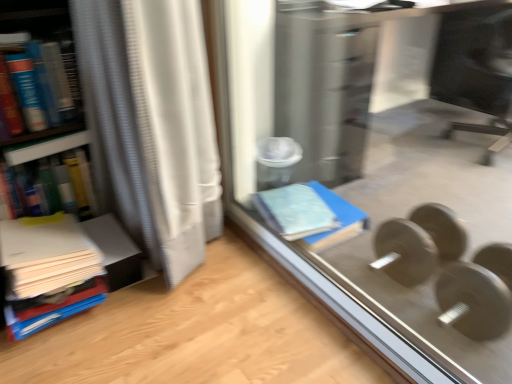
Question: Can you confirm if black glossy monitor at upper right is shorter than matte plastic book at left, the 2th book ordered from the bottom?

Choices:
 (A) no
 (B) yes

Answer: (A)

Question: Are black glossy monitor at upper right and matte plastic book at left, the 2th book ordered from the bottom, located far from each other?

Choices:
 (A) yes
 (B) no

Answer: (A)

Question: Considering the relative positions of black glossy monitor at upper right and matte plastic book at left, the second book from the top, in the image provided, is black glossy monitor at upper right to the right of matte plastic book at left, the second book from the top, from the viewer's perspective?

Choices:
 (A) no
 (B) yes

Answer: (B)

Question: Is black glossy monitor at upper right with matte plastic book at left, the 2th book ordered from the bottom?

Choices:
 (A) yes
 (B) no

Answer: (B)

Question: Is black glossy monitor at upper right behind matte plastic book at left, the 2th book ordered from the bottom?

Choices:
 (A) yes
 (B) no

Answer: (A)

Question: Is black glossy monitor at upper right oriented towards matte plastic book at left, the 2th book ordered from the bottom?

Choices:
 (A) yes
 (B) no

Answer: (A)

Question: Does metallic gray dumbbell at lower right, the first dumbbell in the back-to-front sequence, have a larger size compared to matte plastic book at left, the 2th book ordered from the bottom?

Choices:
 (A) no
 (B) yes

Answer: (A)

Question: Can you confirm if metallic gray dumbbell at lower right, the first dumbbell in the back-to-front sequence, is shorter than matte plastic book at left, the 2th book ordered from the bottom?

Choices:
 (A) no
 (B) yes

Answer: (B)

Question: Does metallic gray dumbbell at lower right, which is counted as the second dumbbell, starting from the front, appear on the left side of matte plastic book at left, the second book from the top?

Choices:
 (A) yes
 (B) no

Answer: (B)

Question: Is metallic gray dumbbell at lower right, the first dumbbell in the back-to-front sequence, taller than matte plastic book at left, the second book from the top?

Choices:
 (A) no
 (B) yes

Answer: (A)

Question: Is metallic gray dumbbell at lower right, which is counted as the second dumbbell, starting from the front, oriented away from matte plastic book at left, the second book from the top?

Choices:
 (A) no
 (B) yes

Answer: (A)

Question: From a real-world perspective, is metallic gray dumbbell at lower right, which is counted as the second dumbbell, starting from the front, physically above matte plastic book at left, the second book from the top?

Choices:
 (A) no
 (B) yes

Answer: (A)

Question: Is the depth of hardcover book at left, the first book in the top-to-bottom sequence, greater than that of white matte paper stack at left, the 1th book from the bottom?

Choices:
 (A) no
 (B) yes

Answer: (B)